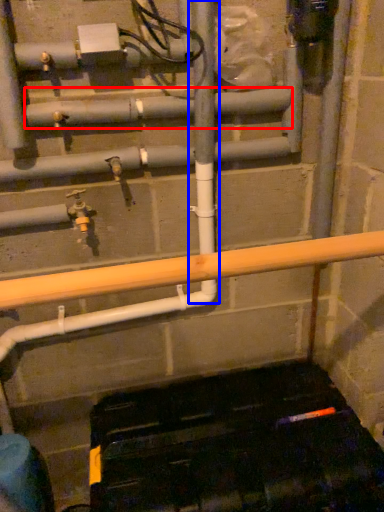
Question: Which point is closer to the camera, pipe (highlighted by a red box) or pole (highlighted by a blue box)?

Choices:
 (A) pipe
 (B) pole

Answer: (B)